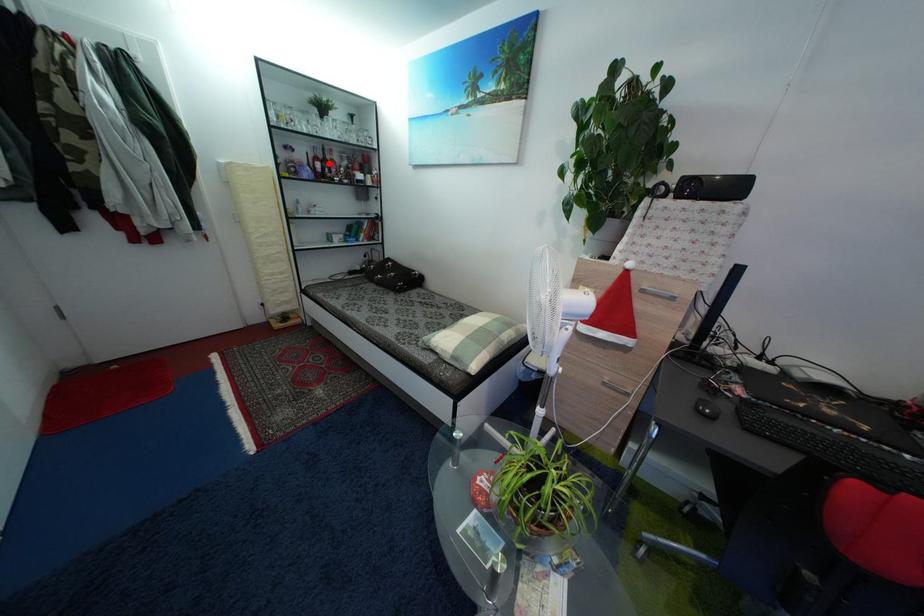
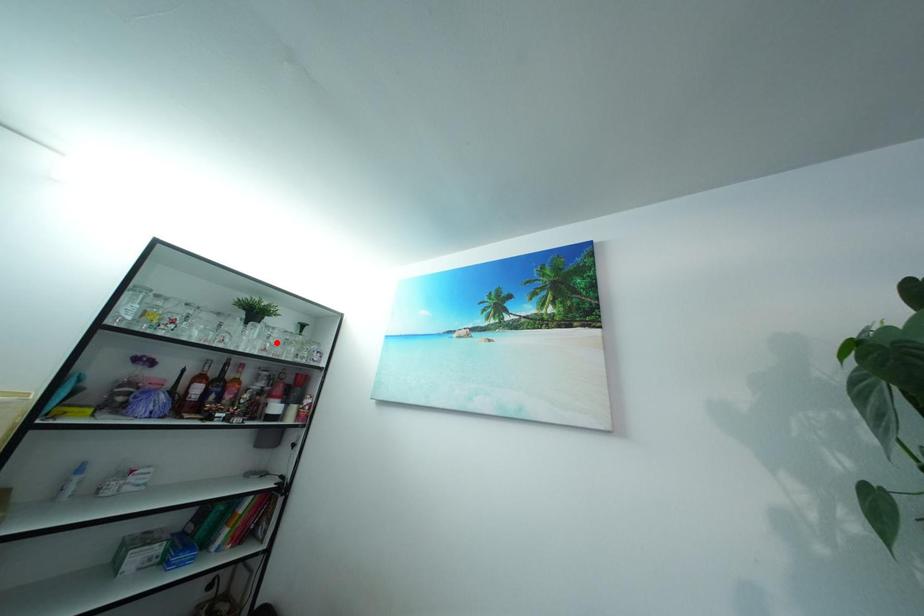
Based on the photo, I am providing you with two images of the same scene from different viewpoints. A red point is marked on the first image and another point is marked on the second image. Are the points marked in image1 and image2 representing the same 3D position?

No